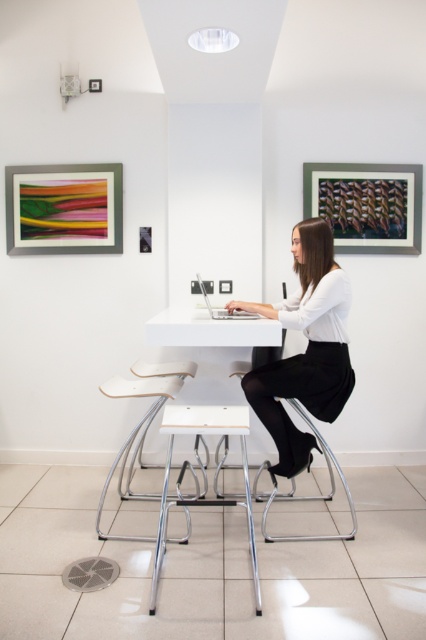
You are standing in the workspace and want to move from the metallic silver picture frame at upper left to the white leather stool at center. Which object will you pass by first?

You will pass by the metallic silver picture frame at upper left first because it is closer to you than the white leather stool at center, which is further away.

You are a delivery person who needs to place a 5 feet long package between the wooden textured frame at upper right and the chrome metal bar stool at center. Can you fit the package between them?

The distance between the wooden textured frame at upper right and the chrome metal bar stool at center is 4.70 feet, which is shorter than the 5 feet long package. Therefore, the package cannot be placed between them.